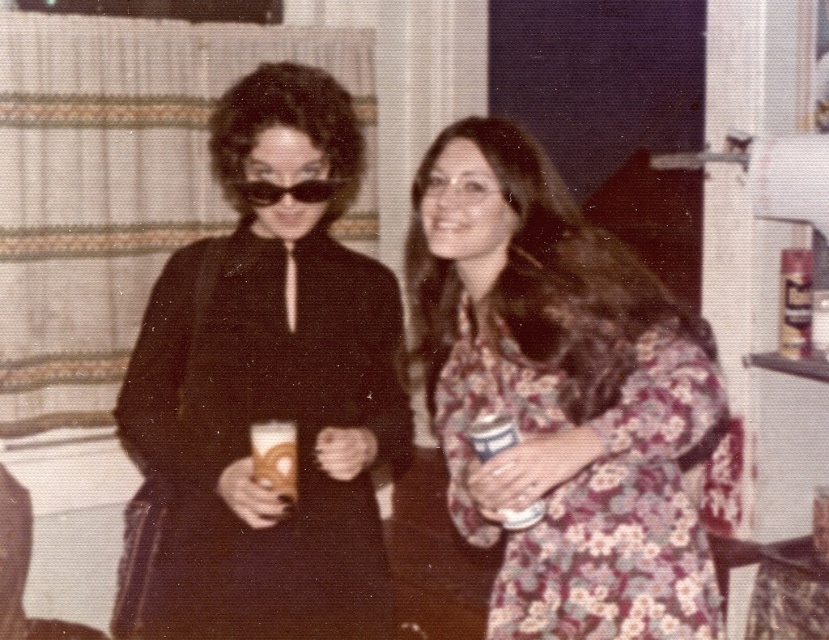
Who is lower down, floral-patterned dress at center or white paper cup at center?

Result: Positioned lower is white paper cup at center.

Between floral-patterned dress at center and white paper cup at center, which one has less height?

With less height is white paper cup at center.

Who is more distant from viewer, (629, 387) or (468, 433)?

The point (468, 433) is behind.

Where is `floral-patterned dress at center`? floral-patterned dress at center is located at coordinates (561, 396).

Can you confirm if white paper cup at center is shorter than matte black sunglasses at center?

In fact, white paper cup at center may be taller than matte black sunglasses at center.

Does point (500, 438) come farther from viewer compared to point (277, 195)?

No, (500, 438) is closer to viewer.

The height and width of the screenshot is (640, 829). Describe the element at coordinates (491, 433) in the screenshot. I see `white paper cup at center` at that location.

Find the location of `white paper cup at center`. white paper cup at center is located at coordinates (491, 433).

Between matte plastic cup at center and white paper cup at center, which one has more height?

Standing taller between the two is white paper cup at center.

Which of these two, matte plastic cup at center or white paper cup at center, stands shorter?

matte plastic cup at center

Is point (289, 461) more distant than point (503, 528)?

No.

You are a GUI agent. You are given a task and a screenshot of the screen. Output one action in this format:
    pyautogui.click(x=<x>, y=<y>)
    Task: Click on the matte plastic cup at center
    The width and height of the screenshot is (829, 640).
    Given the screenshot: What is the action you would take?
    pyautogui.click(x=275, y=458)